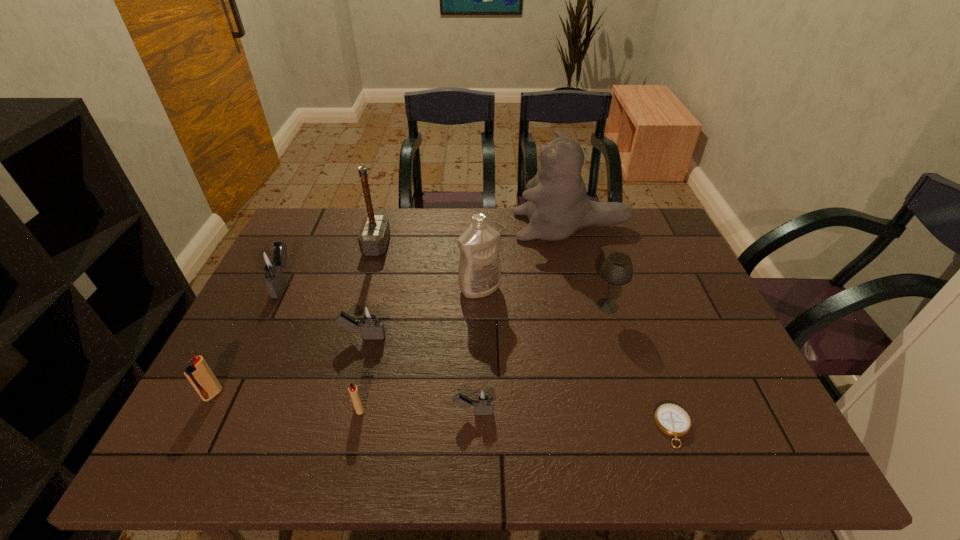
Locate an element on the screen. object at the right edge is located at coordinates (558, 206).

This screenshot has width=960, height=540. I want to click on object that is at the far right corner, so click(558, 206).

At what (x,y) coordinates should I click in order to perform the action: click on blank space at the far edge of the desktop. Please return your answer as a coordinate pair (x, y). Looking at the image, I should click on (580, 229).

The width and height of the screenshot is (960, 540). What are the coordinates of `blank area at the near edge` in the screenshot? It's located at (540, 434).

Where is `free space at the left edge of the desktop`? The image size is (960, 540). free space at the left edge of the desktop is located at coordinates (238, 405).

This screenshot has height=540, width=960. I want to click on free spot at the right edge of the desktop, so click(x=677, y=309).

You are a GUI agent. You are given a task and a screenshot of the screen. Output one action in this format:
    pyautogui.click(x=<x>, y=<y>)
    Task: Click on the free space at the far left corner of the desktop
    This screenshot has width=960, height=540.
    Given the screenshot: What is the action you would take?
    pyautogui.click(x=300, y=218)

Image resolution: width=960 pixels, height=540 pixels. In order to click on free space between the leftmost gray igniter and the fourth nearest object in this screenshot , I will do `click(249, 339)`.

Locate an element on the screen. This screenshot has height=540, width=960. free space between the green cat and the right red igniter is located at coordinates (466, 318).

Where is `vacant area between the brown hammer and the third nearest igniter`? vacant area between the brown hammer and the third nearest igniter is located at coordinates (295, 320).